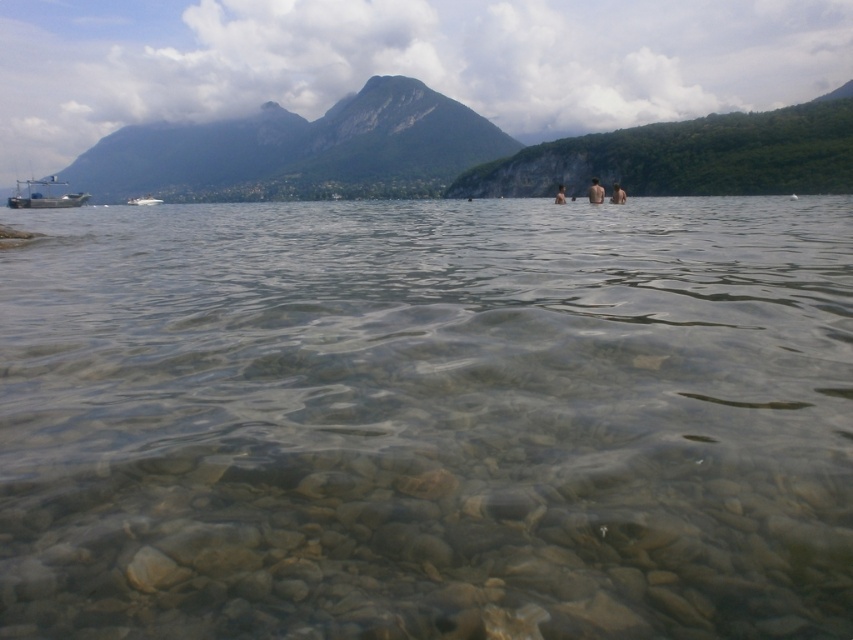
How far apart are metallic gray boat at left and skinny person at center?

metallic gray boat at left is 397.99 feet from skinny person at center.

Between point (33, 196) and point (561, 195), which one is positioned in front?

Point (561, 195)

At what (x,y) coordinates should I click in order to perform the action: click on metallic gray boat at left. Please return your answer as a coordinate pair (x, y). This screenshot has width=853, height=640. Looking at the image, I should click on (45, 195).

How distant is clear rock bottom at center from brown skin couple at center?

clear rock bottom at center and brown skin couple at center are 31.32 meters apart from each other.

Based on the photo, who is positioned more to the right, clear rock bottom at center or brown skin couple at center?

brown skin couple at center is more to the right.

At what (x,y) coordinates should I click in order to perform the action: click on clear rock bottom at center. Please return your answer as a coordinate pair (x, y). The width and height of the screenshot is (853, 640). Looking at the image, I should click on 428,419.

Image resolution: width=853 pixels, height=640 pixels. In order to click on clear rock bottom at center in this screenshot , I will do `click(428, 419)`.

How much distance is there between clear rock bottom at center and white glossy boat at left?

The distance of clear rock bottom at center from white glossy boat at left is 584.28 feet.

What do you see at coordinates (428, 419) in the screenshot? The image size is (853, 640). I see `clear rock bottom at center` at bounding box center [428, 419].

Is point (32, 480) behind point (131, 202)?

No, (32, 480) is closer to viewer.

Where is `clear rock bottom at center`? The image size is (853, 640). clear rock bottom at center is located at coordinates (428, 419).